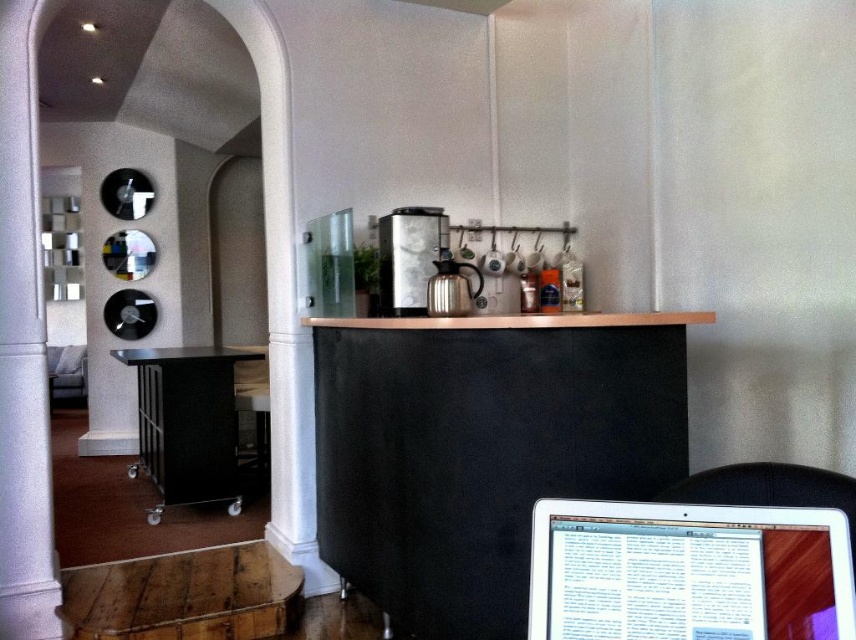
Question: Does black suede table at center appear on the right side of white smooth pillar at left?

Choices:
 (A) no
 (B) yes

Answer: (B)

Question: Is white smooth pillar at left further to the viewer compared to black metal table at lower left?

Choices:
 (A) yes
 (B) no

Answer: (B)

Question: Which object is the closest to the black metal table at lower left?

Choices:
 (A) satin silver coffee machine at center
 (B) white smooth pillar at left
 (C) black plastic stool at lower left

Answer: (C)

Question: Among these objects, which one is nearest to the camera?

Choices:
 (A) white smooth pillar at left
 (B) satin silver coffee machine at center
 (C) black metal table at lower left
 (D) silver metallic laptop at lower right

Answer: (D)

Question: Can you confirm if silver metallic laptop at lower right is smaller than white smooth pillar at left?

Choices:
 (A) yes
 (B) no

Answer: (A)

Question: Which is nearer to the silver metallic laptop at lower right?

Choices:
 (A) satin silver coffee machine at center
 (B) black suede table at center

Answer: (B)